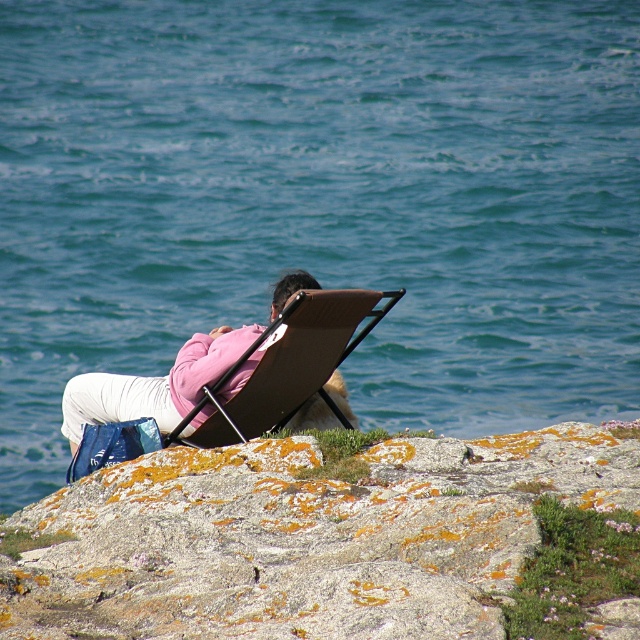
Question: Which of the following is the farthest from the observer?

Choices:
 (A) brown leather chair at center
 (B) pink fabric chair at center
 (C) rocky cliff at lower right

Answer: (B)

Question: Does pink fabric chair at center have a lesser width compared to brown leather chair at center?

Choices:
 (A) yes
 (B) no

Answer: (A)

Question: Which point is closer to the camera?

Choices:
 (A) rocky cliff at lower right
 (B) brown leather chair at center

Answer: (A)

Question: Can you confirm if rocky cliff at lower right is positioned to the right of pink fabric chair at center?

Choices:
 (A) no
 (B) yes

Answer: (B)

Question: Does pink fabric chair at center appear on the left side of brown leather chair at center?

Choices:
 (A) yes
 (B) no

Answer: (A)

Question: Which point is closer to the camera?

Choices:
 (A) rocky cliff at lower right
 (B) pink fabric chair at center
 (C) brown leather chair at center

Answer: (A)